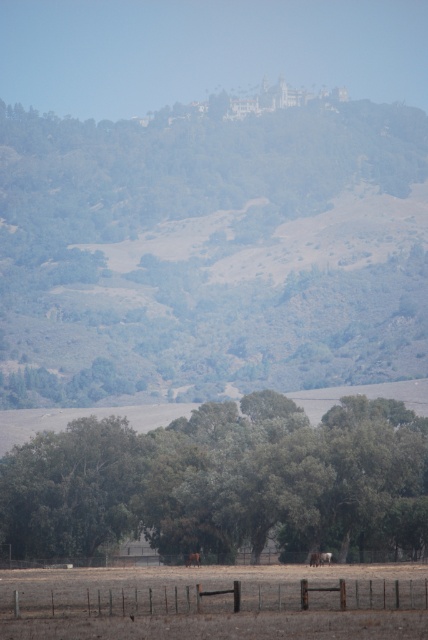
You are standing in the dry open field bordered by a wooden fence and see the green leafy tree at center and the brown furry horse at lower center. Which object is closer to you?

The brown furry horse at lower center is closer to you because it is positioned below the green leafy tree at center, which is farther away.

You are standing at point [216,596] in the rural landscape scene. What object is located exactly at this coordinate?

The rusty metal fence at lower center is located exactly at point [216,596].